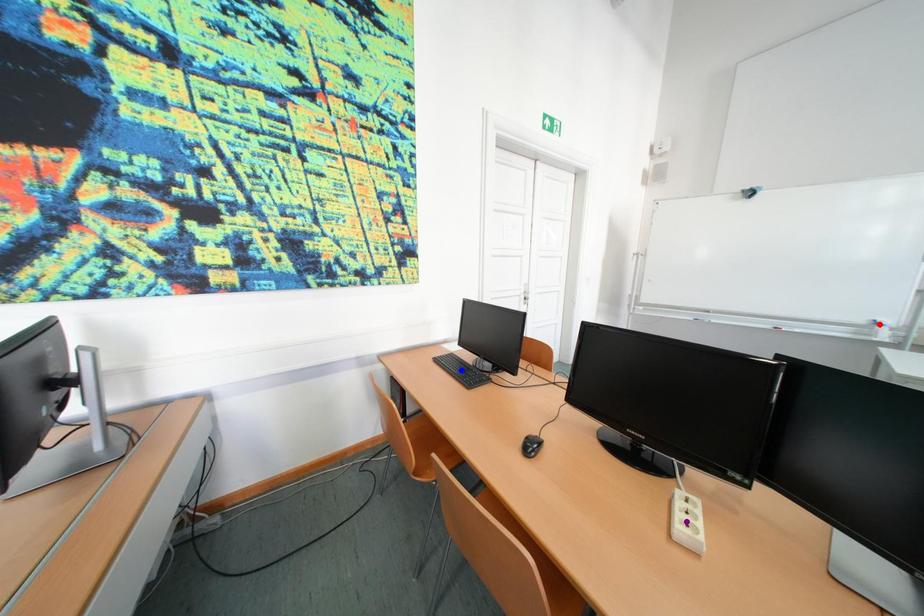
Order these from nearest to farthest:
1. blue point
2. red point
3. purple point

purple point
blue point
red point